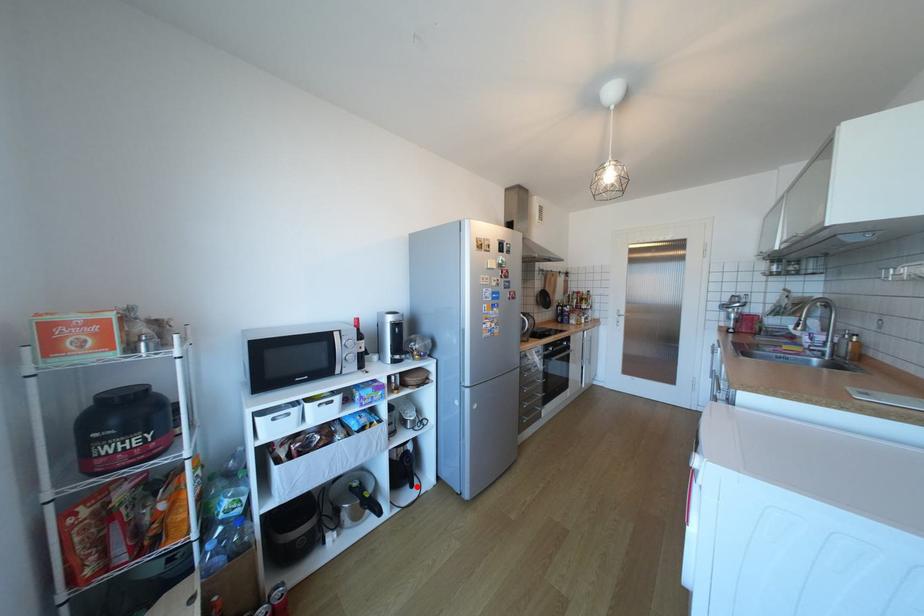
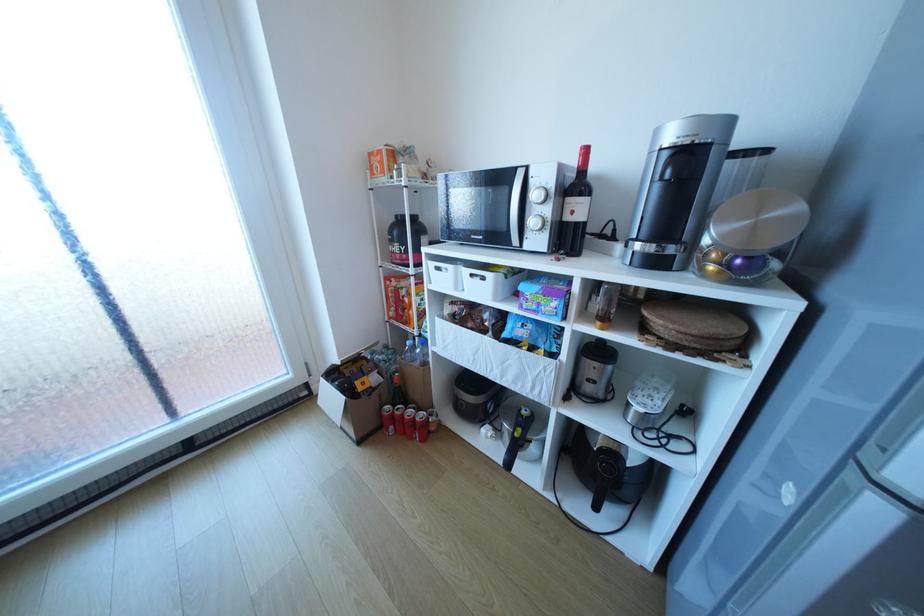
The point at the highlighted location is marked in the first image. Where is the corresponding point in the second image?

(599, 499)